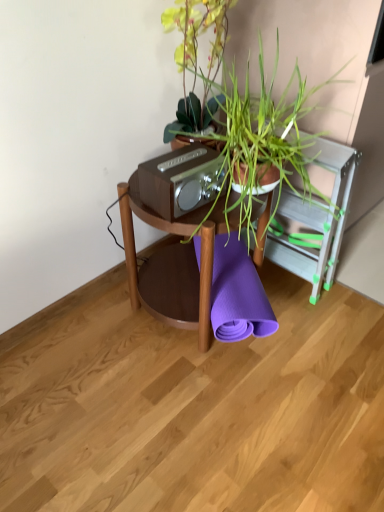
Question: Is woodenmaterial/texturetable at center wider or thinner than green leafy plant at center?

Choices:
 (A) wide
 (B) thin

Answer: (B)

Question: From the image's perspective, is woodenmaterial/texturetable at center positioned above or below green leafy plant at center?

Choices:
 (A) below
 (B) above

Answer: (A)

Question: Based on their relative distances, which object is farther from the green leafy plant at center?

Choices:
 (A) matte brown stereo at center
 (B) woodenmaterial/texturetable at center
 (C) purple rubber yoga mat at center

Answer: (C)

Question: Which of these objects is positioned farthest from the woodenmaterial/texturetable at center?

Choices:
 (A) green leafy plant at center
 (B) purple rubber yoga mat at center
 (C) matte brown stereo at center

Answer: (A)